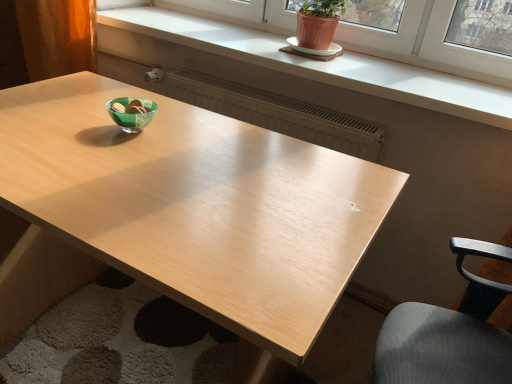
This screenshot has height=384, width=512. I want to click on light wood table at center, so click(x=188, y=211).

Does light wood table at center have a smaller size compared to white ceramic saucer at upper center?

Actually, light wood table at center might be larger than white ceramic saucer at upper center.

From a real-world perspective, which is physically above, light wood table at center or white ceramic saucer at upper center?

From a 3D spatial view, white ceramic saucer at upper center is above.

Is point (172, 110) closer or farther from the camera than point (314, 56)?

Point (172, 110) is positioned closer to the camera compared to point (314, 56).

Looking at this image, between matte white window sill at upper center and matte brown curtain at left, which one is positioned in front?

matte white window sill at upper center.

From the image's perspective, which is below, matte white window sill at upper center or matte brown curtain at left?

matte white window sill at upper center is shown below in the image.

Can you confirm if matte white window sill at upper center is smaller than matte brown curtain at left?

No, matte white window sill at upper center is not smaller than matte brown curtain at left.

Between matte white window sill at upper center and matte brown curtain at left, which one appears on the left side from the viewer's perspective?

From the viewer's perspective, matte brown curtain at left appears more on the left side.

Is point (230, 0) farther from viewer compared to point (11, 204)?

Yes, it is.

Does matte white window sill at upper center appear on the right side of light wood table at center?

Indeed, matte white window sill at upper center is positioned on the right side of light wood table at center.

Does matte white window sill at upper center have a greater height compared to light wood table at center?

No.

Considering the relative sizes of matte white window sill at upper center and light wood table at center in the image provided, is matte white window sill at upper center bigger than light wood table at center?

No.

Is white ceramic saucer at upper center at the left side of matte brown curtain at left?

No.

Is point (334, 49) positioned after point (95, 17)?

That is False.

From the image's perspective, is white ceramic saucer at upper center located beneath matte brown curtain at left?

Yes.

From a real-world perspective, who is located lower, white ceramic saucer at upper center or light wood table at center?

From a 3D spatial view, light wood table at center is below.

Where is `saucer above the light wood table at center (from the image's perspective)`? The image size is (512, 384). saucer above the light wood table at center (from the image's perspective) is located at coordinates (313, 49).

Can you confirm if white ceramic saucer at upper center is positioned to the right of light wood table at center?

Indeed, white ceramic saucer at upper center is positioned on the right side of light wood table at center.

Would you consider white ceramic saucer at upper center to be distant from light wood table at center?

No.

Would you say matte white window sill at upper center is part of matte brown curtain at left's contents?

No.

From a real-world perspective, between matte brown curtain at left and matte white window sill at upper center, who is vertically lower?

matte brown curtain at left, from a real-world perspective.

Which object is thinner, matte brown curtain at left or matte white window sill at upper center?

Thinner between the two is matte brown curtain at left.

Is matte white window sill at upper center to the right of white ceramic saucer at upper center from the viewer's perspective?

No.

From a real-world perspective, is matte white window sill at upper center physically located above or below white ceramic saucer at upper center?

In terms of real-world spatial position, matte white window sill at upper center is below white ceramic saucer at upper center.

Does point (444, 55) come farther from viewer compared to point (340, 51)?

No, it is not.

Is white ceramic saucer at upper center inside matte white window sill at upper center?

Definitely not — white ceramic saucer at upper center is not inside matte white window sill at upper center.

The height and width of the screenshot is (384, 512). I want to click on table in front of the white ceramic saucer at upper center, so click(188, 211).

At what (x,y) coordinates should I click in order to perform the action: click on window on the right side of matte brown curtain at left. Please return your answer as a coordinate pair (x, y). This screenshot has width=512, height=384. Looking at the image, I should click on (426, 44).

Looking at the image, which one is located closer to light wood table at center, matte white window sill at upper center or matte brown curtain at left?

Based on the image, matte brown curtain at left appears to be nearer to light wood table at center.

Which object lies nearer to the anchor point matte brown curtain at left, matte white window sill at upper center or white ceramic saucer at upper center?

white ceramic saucer at upper center is closer to matte brown curtain at left.

Looking at the image, which one is located closer to light wood table at center, matte white window sill at upper center or white ceramic saucer at upper center?

white ceramic saucer at upper center.

Based on their spatial positions, is light wood table at center or white ceramic saucer at upper center closer to matte white window sill at upper center?

white ceramic saucer at upper center.

Estimate the real-world distances between objects in this image. Which object is closer to white ceramic saucer at upper center, matte white window sill at upper center or light wood table at center?

Based on the image, matte white window sill at upper center appears to be nearer to white ceramic saucer at upper center.

Considering their positions, is white ceramic saucer at upper center positioned further to matte white window sill at upper center than light wood table at center?

light wood table at center is positioned further to the anchor matte white window sill at upper center.

Based on their spatial positions, is white ceramic saucer at upper center or light wood table at center closer to matte brown curtain at left?

Based on the image, light wood table at center appears to be nearer to matte brown curtain at left.

When comparing their distances from matte white window sill at upper center, does white ceramic saucer at upper center or matte brown curtain at left seem further?

Among the two, matte brown curtain at left is located further to matte white window sill at upper center.

I want to click on window between matte brown curtain at left and white ceramic saucer at upper center in the horizontal direction, so click(426, 44).

The image size is (512, 384). What are the coordinates of `window between light wood table at center and matte brown curtain at left in the front-back direction` in the screenshot? It's located at (426, 44).

Where is `saucer between light wood table at center and matte brown curtain at left along the z-axis`? This screenshot has height=384, width=512. saucer between light wood table at center and matte brown curtain at left along the z-axis is located at coordinates (313, 49).

Where is `window between light wood table at center and white ceramic saucer at upper center in the front-back direction`? This screenshot has width=512, height=384. window between light wood table at center and white ceramic saucer at upper center in the front-back direction is located at coordinates (426, 44).